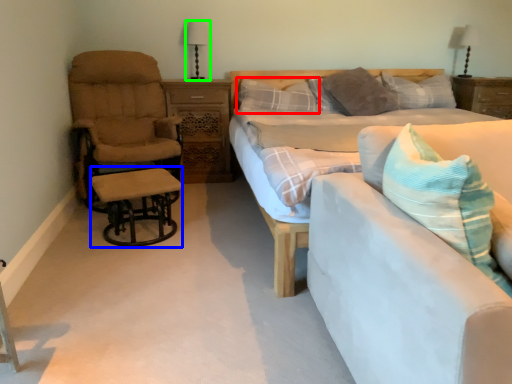
Question: Which is nearer to the pillow (highlighted by a red box)? table (highlighted by a blue box) or table lamp (highlighted by a green box).

Choices:
 (A) table
 (B) table lamp

Answer: (B)